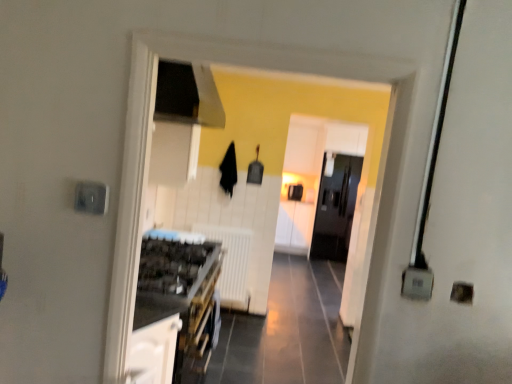
Question: Does point (140, 360) appear closer or farther from the camera than point (236, 256)?

Choices:
 (A) closer
 (B) farther

Answer: (A)

Question: Is white glossy cabinet at lower left, positioned as the 1th cabinetry in left-to-right order, situated inside white matte radiator at center or outside?

Choices:
 (A) inside
 (B) outside

Answer: (B)

Question: Which object is positioned farthest from the white matte radiator at center?

Choices:
 (A) white glossy cabinet at center, which appears as the 2th cabinetry when viewed from the front
 (B) black glossy refrigerator at center
 (C) white glossy cabinet at lower left, positioned as the 1th cabinetry in left-to-right order

Answer: (A)

Question: Which object is the closest to the white glossy cabinet at lower left, which is the 1th cabinetry from front to back?

Choices:
 (A) white glossy cabinet at center, the 1th cabinetry viewed from the right
 (B) white matte radiator at center
 (C) black glossy refrigerator at center

Answer: (B)